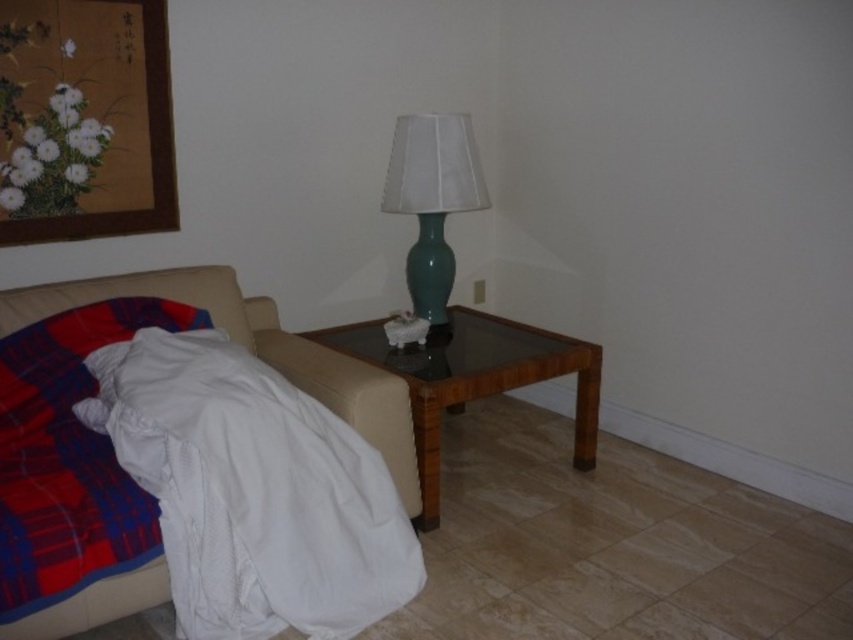
Does point (27, 67) lie behind point (68, 529)?

Yes, it is.

Between wooden framed artwork at upper left and plaid fabric blanket at lower left, which one has more height?

With more height is wooden framed artwork at upper left.

Does point (78, 182) lie behind point (96, 577)?

Yes.

This screenshot has width=853, height=640. In order to click on wooden framed artwork at upper left in this screenshot , I will do `click(84, 120)`.

Between point (405, 566) and point (28, 138), which one is positioned behind?

Point (28, 138)

Who is lower down, white textured blanket at lower left or wooden framed artwork at upper left?

white textured blanket at lower left

The height and width of the screenshot is (640, 853). I want to click on white textured blanket at lower left, so point(254,492).

I want to click on white textured blanket at lower left, so [x=254, y=492].

Can you confirm if white textured blanket at lower left is positioned above plaid fabric blanket at lower left?

Actually, white textured blanket at lower left is below plaid fabric blanket at lower left.

Between white textured blanket at lower left and plaid fabric blanket at lower left, which one appears on the left side from the viewer's perspective?

plaid fabric blanket at lower left

At what (x,y) coordinates should I click in order to perform the action: click on white textured blanket at lower left. Please return your answer as a coordinate pair (x, y). The width and height of the screenshot is (853, 640). Looking at the image, I should click on (254, 492).